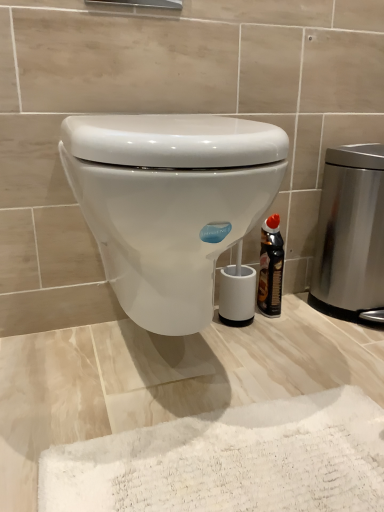
Question: Can you confirm if black glossy bottle at right is shorter than white glossy toilet at center?

Choices:
 (A) no
 (B) yes

Answer: (B)

Question: Is white glossy toilet at center surrounded by black glossy bottle at right?

Choices:
 (A) no
 (B) yes

Answer: (A)

Question: Does black glossy bottle at right come in front of white glossy toilet at center?

Choices:
 (A) no
 (B) yes

Answer: (A)

Question: Considering the relative positions of black glossy bottle at right and white glossy toilet at center in the image provided, is black glossy bottle at right to the left of white glossy toilet at center from the viewer's perspective?

Choices:
 (A) yes
 (B) no

Answer: (B)

Question: From the image's perspective, is black glossy bottle at right on top of white glossy toilet at center?

Choices:
 (A) yes
 (B) no

Answer: (B)

Question: From the image's perspective, relative to black glossy bottle at right, is white glossy toilet at center above or below?

Choices:
 (A) below
 (B) above

Answer: (B)

Question: From a real-world perspective, is white glossy toilet at center positioned above or below black glossy bottle at right?

Choices:
 (A) above
 (B) below

Answer: (A)

Question: In terms of width, does white glossy toilet at center look wider or thinner when compared to black glossy bottle at right?

Choices:
 (A) wide
 (B) thin

Answer: (A)

Question: Is point (173, 214) positioned closer to the camera than point (266, 296)?

Choices:
 (A) closer
 (B) farther

Answer: (A)

Question: Is stainless steel trash can at right wider or thinner than white glossy toilet at center?

Choices:
 (A) thin
 (B) wide

Answer: (A)

Question: Considering their positions, is stainless steel trash can at right located in front of or behind white glossy toilet at center?

Choices:
 (A) front
 (B) behind

Answer: (B)

Question: From a real-world perspective, relative to white glossy toilet at center, is stainless steel trash can at right vertically above or below?

Choices:
 (A) above
 (B) below

Answer: (B)

Question: In terms of size, does stainless steel trash can at right appear bigger or smaller than white glossy toilet at center?

Choices:
 (A) small
 (B) big

Answer: (A)

Question: Is stainless steel trash can at right wider or thinner than black glossy bottle at right?

Choices:
 (A) thin
 (B) wide

Answer: (B)

Question: Is stainless steel trash can at right inside the boundaries of black glossy bottle at right, or outside?

Choices:
 (A) outside
 (B) inside

Answer: (A)